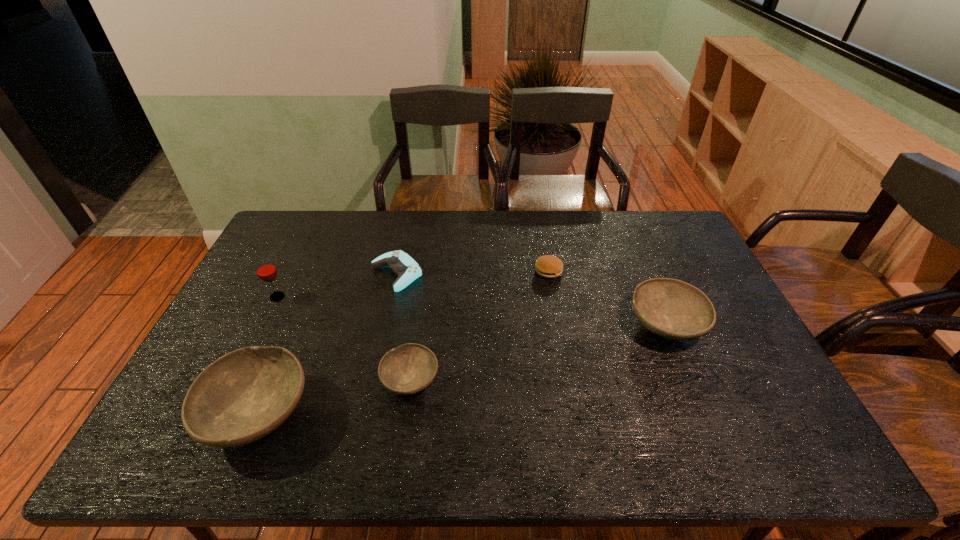
Where is `the leftmost bowl`? the leftmost bowl is located at coordinates (243, 396).

Locate an element on the screen. This screenshot has height=540, width=960. the fourth tallest object is located at coordinates (410, 368).

Where is `the second bowl from right to left`? The width and height of the screenshot is (960, 540). the second bowl from right to left is located at coordinates (410, 368).

Locate an element on the screen. the third tallest object is located at coordinates (670, 308).

Locate an element on the screen. the rightmost object is located at coordinates (670, 308).

Locate an element on the screen. This screenshot has height=540, width=960. control is located at coordinates (407, 269).

Where is `patty`? This screenshot has height=540, width=960. patty is located at coordinates (547, 266).

Where is `glass`? This screenshot has width=960, height=540. glass is located at coordinates (266, 271).

Identify the location of vacant space located on the right of the leftmost bowl. The height and width of the screenshot is (540, 960). (377, 413).

Find the location of `blank space located on the left of the third shortest object`. blank space located on the left of the third shortest object is located at coordinates (319, 380).